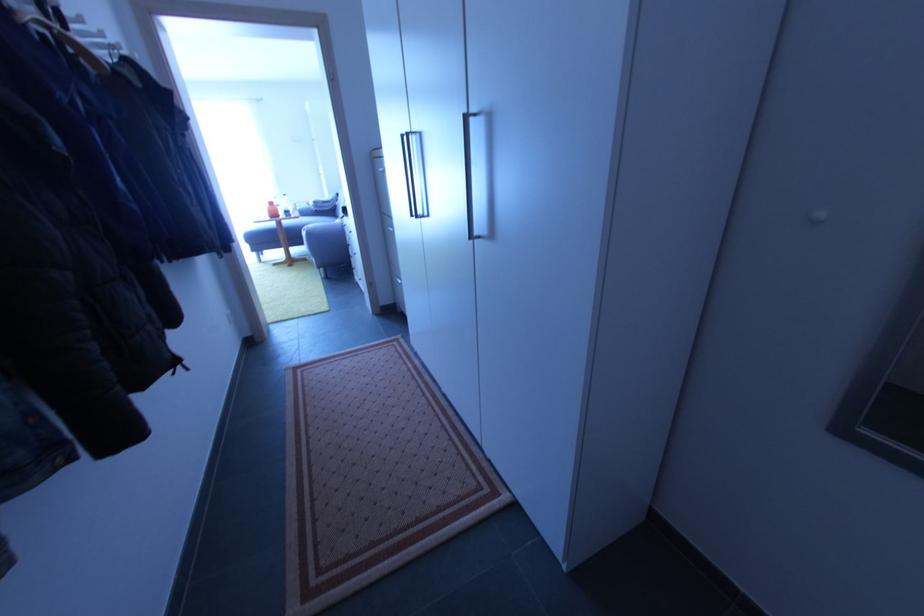
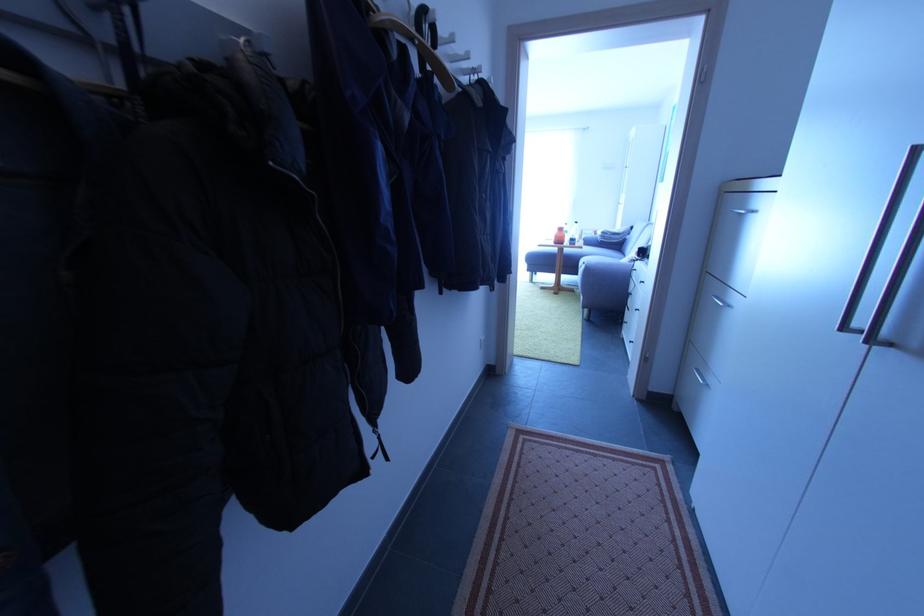
Question: The images are taken continuously from a first-person perspective. In which direction is your viewpoint rotating?

Choices:
 (A) Left
 (B) Right
 (C) Up
 (D) Down

Answer: (A)